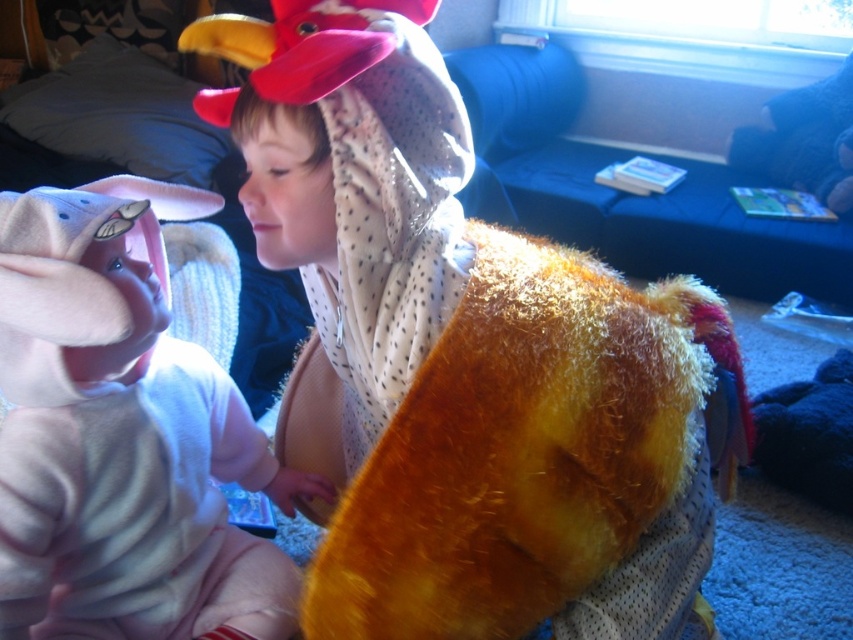
Measure the distance between point (669, 509) and camera.

The distance of point (669, 509) from camera is 1.07 meters.

Between fuzzy yellow costume at center and soft pink plush toy at left, which one has more height?

With more height is fuzzy yellow costume at center.

Where is `fuzzy yellow costume at center`? fuzzy yellow costume at center is located at coordinates (465, 358).